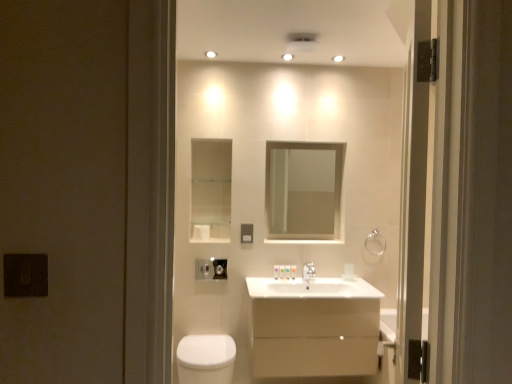
Locate an element on the screen. This screenshot has height=384, width=512. vacant space situated on the left part of satin nickel faucet at center is located at coordinates (281, 280).